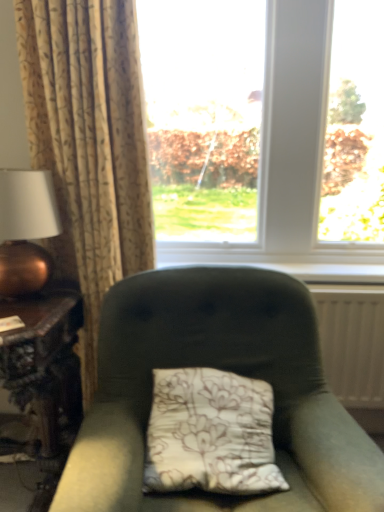
Question: Would you say beige floral fabric curtain at left is to the left or to the right of copper metallic table lamp at left in the picture?

Choices:
 (A) right
 (B) left

Answer: (A)

Question: In terms of size, does beige floral fabric curtain at left appear bigger or smaller than copper metallic table lamp at left?

Choices:
 (A) big
 (B) small

Answer: (A)

Question: Which object is positioned farthest from the beige floral fabric curtain at left?

Choices:
 (A) copper metallic table lamp at left
 (B) white textured radiator at right
 (C) transparent glass window at center
 (D) white painted wood at center
 (E) wooden carved table at left

Answer: (B)

Question: Which is nearer to the velvet green chair at center?

Choices:
 (A) transparent glass window at center
 (B) white textured radiator at right
 (C) copper metallic table lamp at left
 (D) white painted wood at center
 (E) wooden carved table at left

Answer: (E)